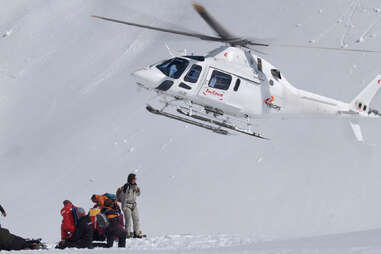
At what (x,y) coordinates should I click in order to perform the action: click on doors. Please return your answer as a coordinate pair (x, y). Image resolution: width=381 pixels, height=254 pixels. Looking at the image, I should click on (190, 80), (215, 92).